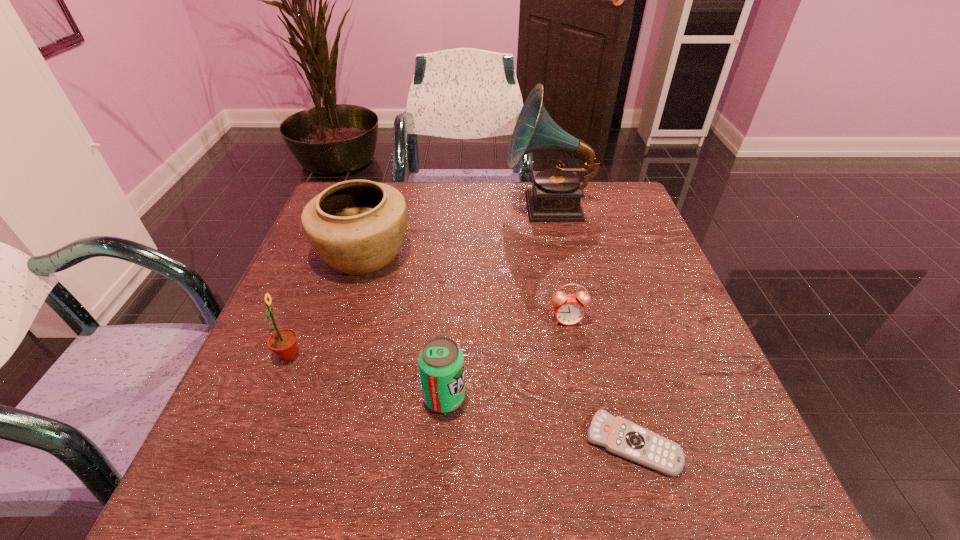
The width and height of the screenshot is (960, 540). I want to click on vacant space at the far right corner of the desktop, so click(583, 200).

What are the coordinates of `free space at the near right corner of the desktop` in the screenshot? It's located at (727, 496).

At what (x,y) coordinates should I click in order to perform the action: click on empty space that is in between the fourth tallest object and the second shortest object. Please return your answer as a coordinate pair (x, y). The height and width of the screenshot is (540, 960). Looking at the image, I should click on (506, 359).

You are a GUI agent. You are given a task and a screenshot of the screen. Output one action in this format:
    pyautogui.click(x=<x>, y=<y>)
    Task: Click on the free space between the pottery and the pop soda
    This screenshot has width=960, height=540.
    Given the screenshot: What is the action you would take?
    pyautogui.click(x=404, y=326)

Find the location of a particular element. vacant area that lies between the sunflower and the pop soda is located at coordinates (367, 376).

The image size is (960, 540). In order to click on free space between the pottery and the alarm clock in this screenshot , I will do `click(466, 287)`.

Locate an element on the screen. The image size is (960, 540). free spot between the third object from left to right and the shortest object is located at coordinates (539, 421).

Image resolution: width=960 pixels, height=540 pixels. Find the location of `vacant area between the tallest object and the third object from left to right`. vacant area between the tallest object and the third object from left to right is located at coordinates (496, 302).

What are the coordinates of `empty location between the third object from left to right and the fourth farthest object` in the screenshot? It's located at (367, 376).

Identify the location of free space between the second shortest object and the sunflower. (428, 338).